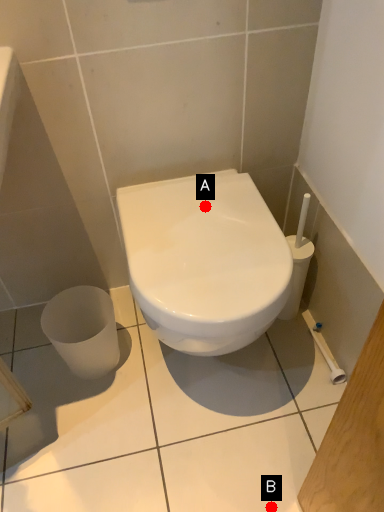
Question: Two points are circled on the image, labeled by A and B beside each circle. Which point appears farthest from the camera in this image?

Choices:
 (A) A is further
 (B) B is further

Answer: (A)